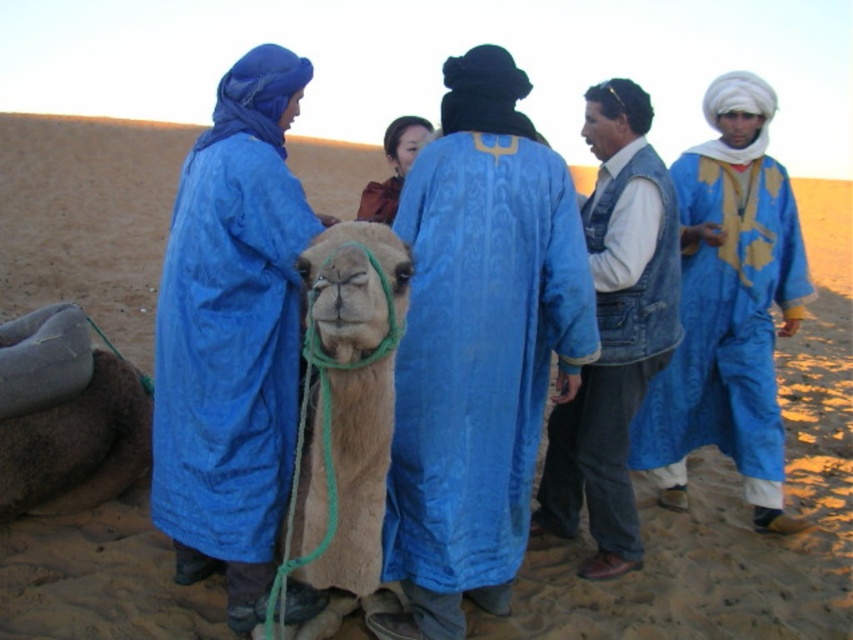
You are a photographer positioned in front of the group of people in traditional attire. You notice the fuzzy beige camel at center and the smooth brown leather jacket at center. Which object is positioned to the left when facing the scene?

The fuzzy beige camel at center is positioned to the left of the smooth brown leather jacket at center.

You are a photographer trying to capture the group of people in the desert scene. You notice two points in the image labeled as point 1 at coordinates (312,499) and point 2 at (408,160). Which point is closer to your camera lens?

Point 1 at coordinates (312,499) is closer to the camera lens than point 2 at (408,160).

You are standing in the desert scene and want to walk from point (x=538, y=266) to point (x=270, y=480). Which direction should you face to move towards the latter point?

Since point (x=538, y=266) is closer to you than point (x=270, y=480), you should face away from yourself towards the lower right direction to move towards point (x=270, y=480).